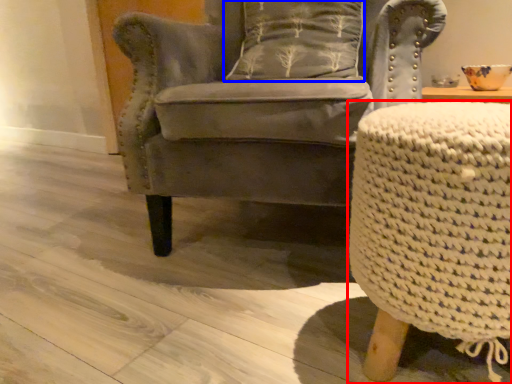
Question: Among these objects, which one is farthest to the camera, table (highlighted by a red box) or pillow (highlighted by a blue box)?

Choices:
 (A) table
 (B) pillow

Answer: (B)